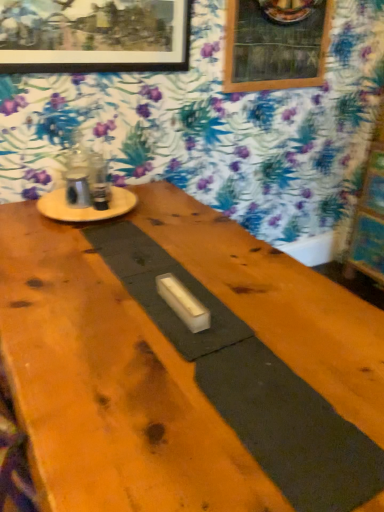
Image resolution: width=384 pixels, height=512 pixels. Find the location of `empty space that is ontop of wooden round table at upper left (from a real-world perspective)`. empty space that is ontop of wooden round table at upper left (from a real-world perspective) is located at coordinates (90, 197).